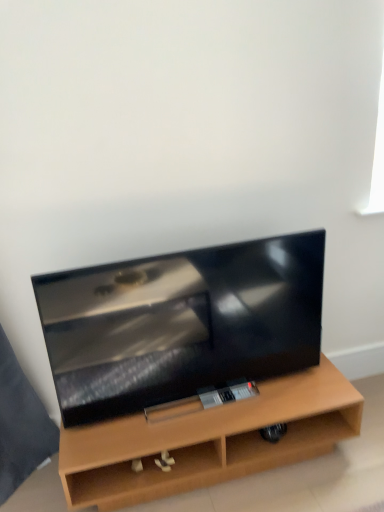
Where is `vacant space underneath matte black tv at center (from a real-world perspective)`? The width and height of the screenshot is (384, 512). vacant space underneath matte black tv at center (from a real-world perspective) is located at coordinates (197, 398).